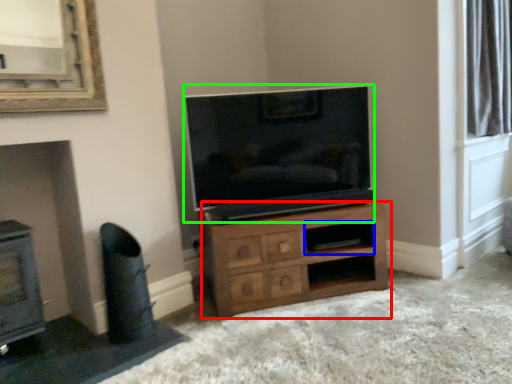
Question: Based on their relative distances, which object is farther from chest of drawers (highlighted by a red box)? Choose from shelf (highlighted by a blue box) and television (highlighted by a green box).

Choices:
 (A) shelf
 (B) television

Answer: (B)